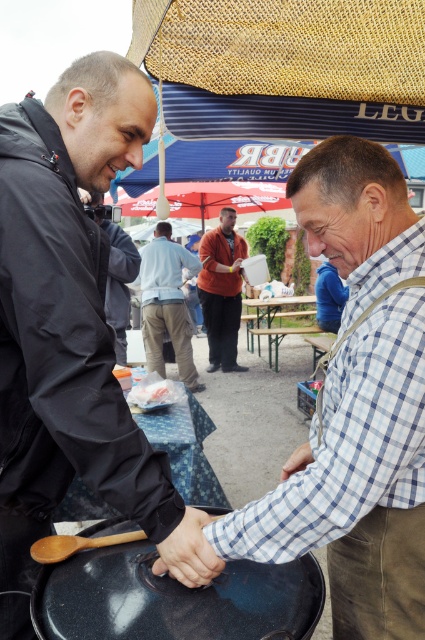
Question: Which point appears farthest from the camera in this image?

Choices:
 (A) (399, 132)
 (B) (176, 275)

Answer: (B)

Question: Is orange cotton shirt at center positioned in front of dark gray jacket at left?

Choices:
 (A) no
 (B) yes

Answer: (A)

Question: Does light blue shirt at center appear on the left side of dark gray jacket at left?

Choices:
 (A) no
 (B) yes

Answer: (A)

Question: Which point is farther from the camera taking this photo?

Choices:
 (A) (354, 621)
 (B) (142, 284)
 (C) (204, 557)
 (D) (203, 282)

Answer: (D)

Question: Considering the real-world distances, which object is closest to the orange cotton shirt at center?

Choices:
 (A) smooth skin hand at center
 (B) light blue plaid shirt at center
 (C) dark gray jacket at left
 (D) burlap canopy at upper center

Answer: (C)

Question: Is the position of burlap canopy at upper center more distant than that of smooth skin hand at center?

Choices:
 (A) yes
 (B) no

Answer: (A)